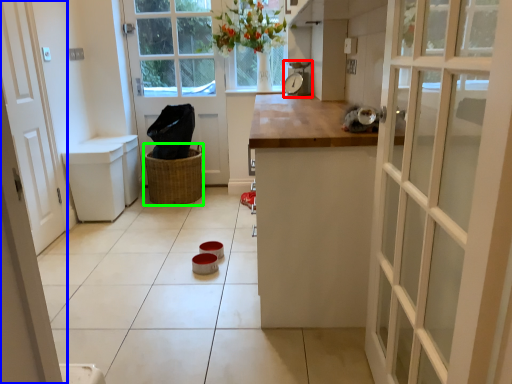
Question: Based on their relative distances, which object is nearer to appliance (highlighted by a red box)? Choose from door (highlighted by a blue box) and basket (highlighted by a green box).

Choices:
 (A) door
 (B) basket

Answer: (B)